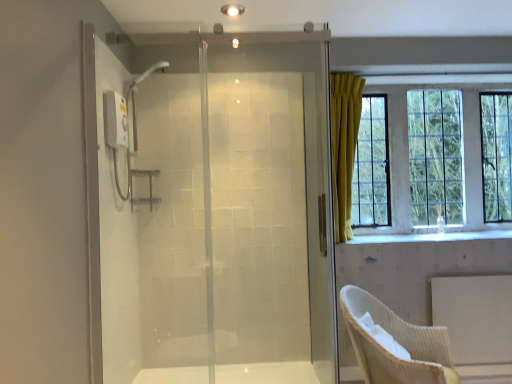
Question: Is the depth of woven beige chair at lower right less than that of transparent glass shower door at center?

Choices:
 (A) yes
 (B) no

Answer: (A)

Question: Would you say woven beige chair at lower right is a long distance from transparent glass shower door at center?

Choices:
 (A) no
 (B) yes

Answer: (A)

Question: From a real-world perspective, is woven beige chair at lower right below transparent glass shower door at center?

Choices:
 (A) no
 (B) yes

Answer: (B)

Question: Is woven beige chair at lower right aimed at transparent glass shower door at center?

Choices:
 (A) no
 (B) yes

Answer: (A)

Question: Is woven beige chair at lower right at the left side of transparent glass shower door at center?

Choices:
 (A) yes
 (B) no

Answer: (B)

Question: Can you confirm if woven beige chair at lower right is taller than transparent glass shower door at center?

Choices:
 (A) no
 (B) yes

Answer: (A)

Question: From a real-world perspective, is transparent glass shower door at center positioned over yellow fabric curtain at upper right based on gravity?

Choices:
 (A) yes
 (B) no

Answer: (B)

Question: Is transparent glass shower door at center directly adjacent to yellow fabric curtain at upper right?

Choices:
 (A) no
 (B) yes

Answer: (A)

Question: Considering the relative sizes of transparent glass shower door at center and yellow fabric curtain at upper right in the image provided, is transparent glass shower door at center shorter than yellow fabric curtain at upper right?

Choices:
 (A) yes
 (B) no

Answer: (B)

Question: Is transparent glass shower door at center not near yellow fabric curtain at upper right?

Choices:
 (A) yes
 (B) no

Answer: (A)

Question: Is transparent glass shower door at center facing away from yellow fabric curtain at upper right?

Choices:
 (A) yes
 (B) no

Answer: (B)

Question: From the image's perspective, is transparent glass shower door at center over yellow fabric curtain at upper right?

Choices:
 (A) yes
 (B) no

Answer: (B)

Question: Is yellow fabric curtain at upper right facing away from woven beige chair at lower right?

Choices:
 (A) no
 (B) yes

Answer: (A)